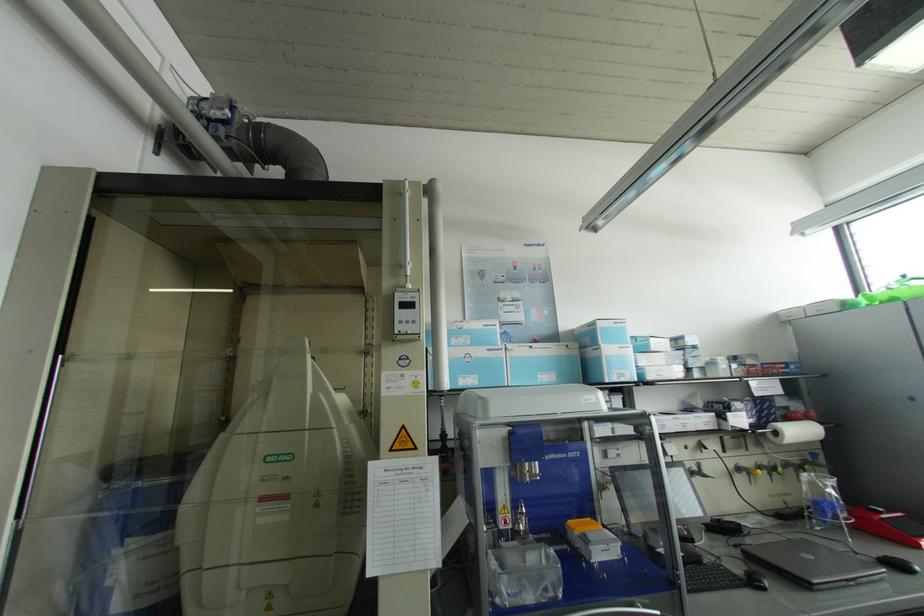
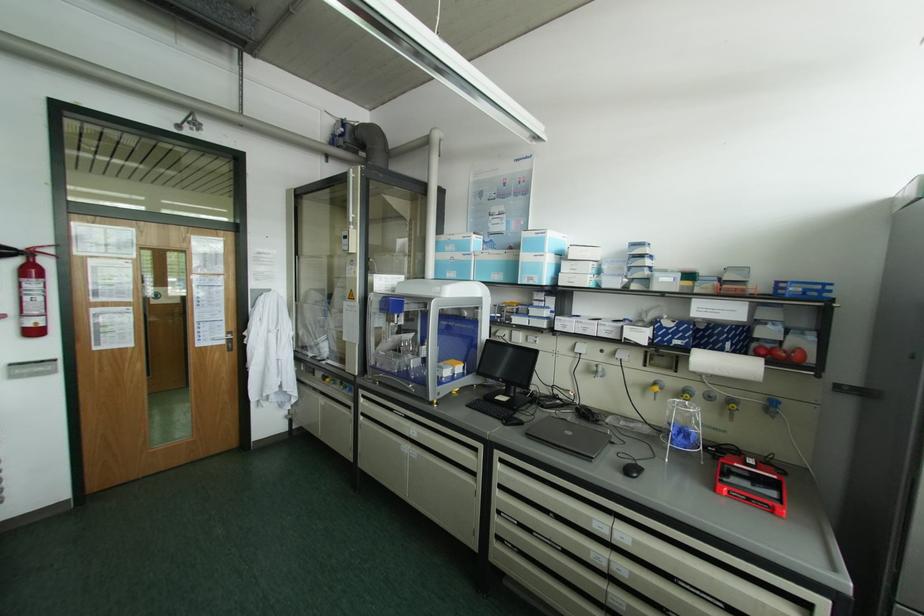
Find the pixel in the second image that matches point (621, 374) in the first image.

(530, 278)